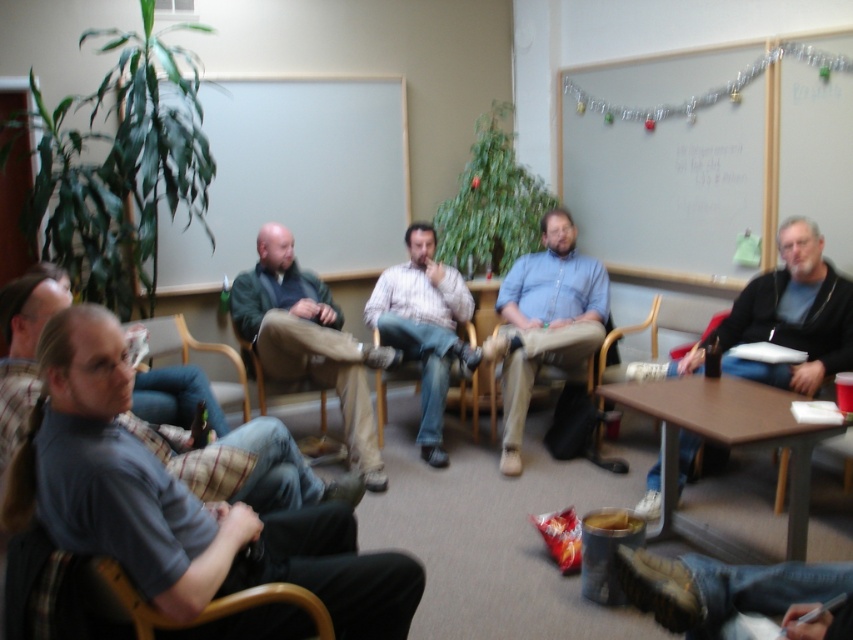
Is dark blue shirt at center positioned in front of matte gray shirt at center?

Yes, it is in front of matte gray shirt at center.

Can you confirm if dark blue shirt at center is wider than matte gray shirt at center?

Yes.

Who is more forward, [645,506] or [0,324]?

Point [0,324] is more forward.

At what (x,y) coordinates should I click in order to perform the action: click on dark blue shirt at center. Please return your answer as a coordinate pair (x, y). This screenshot has height=640, width=853. Looking at the image, I should click on (788, 316).

Is whiteboard at upper center wider than striped cotton shirt at center?

Indeed, whiteboard at upper center has a greater width compared to striped cotton shirt at center.

Is point (222, 156) behind point (370, 298)?

Yes.

This screenshot has width=853, height=640. Find the location of `whiteboard at upper center`. whiteboard at upper center is located at coordinates (294, 179).

Is green fabric jacket at center behind blue shirt at center?

That is False.

Can you confirm if green fabric jacket at center is shorter than blue shirt at center?

Indeed, green fabric jacket at center has a lesser height compared to blue shirt at center.

You are a GUI agent. You are given a task and a screenshot of the screen. Output one action in this format:
    pyautogui.click(x=<x>, y=<y>)
    Task: Click on the green fabric jacket at center
    Image resolution: width=853 pixels, height=640 pixels.
    Given the screenshot: What is the action you would take?
    pyautogui.click(x=308, y=340)